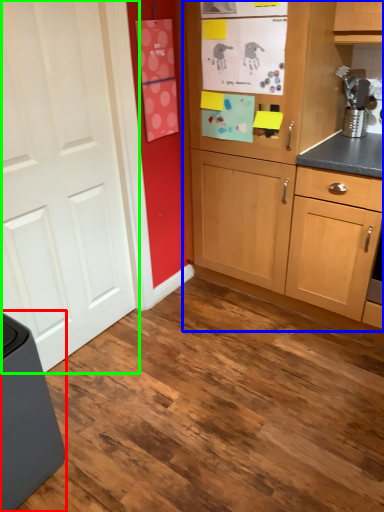
Question: Considering the real-world distances, which object is closest to home appliance (highlighted by a red box)? cabinetry (highlighted by a blue box) or door (highlighted by a green box).

Choices:
 (A) cabinetry
 (B) door

Answer: (B)